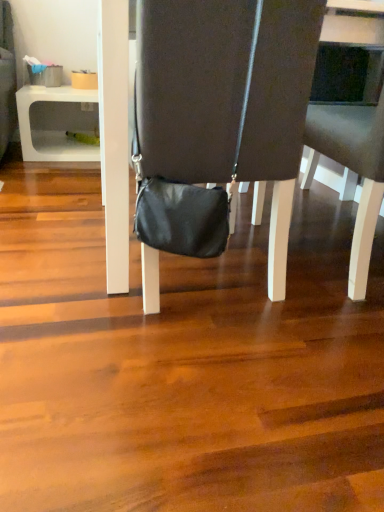
Question: Does matte black bag at center, marked as the first chair in a left-to-right arrangement, have a larger size compared to white plastic table at lower left?

Choices:
 (A) no
 (B) yes

Answer: (B)

Question: Considering the relative sizes of matte black bag at center, marked as the first chair in a left-to-right arrangement, and white plastic table at lower left in the image provided, is matte black bag at center, marked as the first chair in a left-to-right arrangement, smaller than white plastic table at lower left?

Choices:
 (A) no
 (B) yes

Answer: (A)

Question: Is matte black bag at center, marked as the first chair in a left-to-right arrangement, at the left side of white plastic table at lower left?

Choices:
 (A) no
 (B) yes

Answer: (A)

Question: Considering the relative sizes of matte black bag at center, the 2th chair positioned from the right, and white plastic table at lower left in the image provided, is matte black bag at center, the 2th chair positioned from the right, shorter than white plastic table at lower left?

Choices:
 (A) yes
 (B) no

Answer: (B)

Question: Is matte black bag at center, marked as the first chair in a left-to-right arrangement, located outside white plastic table at lower left?

Choices:
 (A) yes
 (B) no

Answer: (A)

Question: Is matte black bag at center, the 2th chair positioned from the right, positioned before white plastic table at lower left?

Choices:
 (A) no
 (B) yes

Answer: (B)

Question: Is white plastic table at lower left oriented towards dark gray fabric chair at center, the first chair from the right?

Choices:
 (A) no
 (B) yes

Answer: (A)

Question: Can you confirm if white plastic table at lower left is wider than dark gray fabric chair at center, the first chair from the right?

Choices:
 (A) no
 (B) yes

Answer: (B)

Question: Does white plastic table at lower left appear on the right side of dark gray fabric chair at center, acting as the 2th chair starting from the left?

Choices:
 (A) yes
 (B) no

Answer: (B)

Question: Does white plastic table at lower left come behind dark gray fabric chair at center, acting as the 2th chair starting from the left?

Choices:
 (A) no
 (B) yes

Answer: (B)

Question: From the image's perspective, does white plastic table at lower left appear higher than dark gray fabric chair at center, the first chair from the right?

Choices:
 (A) yes
 (B) no

Answer: (A)

Question: Is white plastic table at lower left shorter than dark gray fabric chair at center, the first chair from the right?

Choices:
 (A) no
 (B) yes

Answer: (B)

Question: From the image's perspective, would you say dark gray fabric chair at center, acting as the 2th chair starting from the left, is shown under white plastic table at lower left?

Choices:
 (A) yes
 (B) no

Answer: (A)